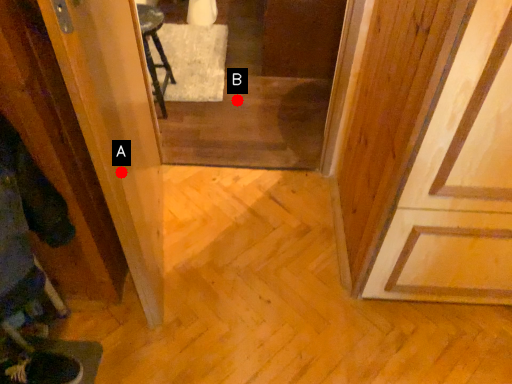
Question: Two points are circled on the image, labeled by A and B beside each circle. Which point is closer to the camera taking this photo?

Choices:
 (A) A is closer
 (B) B is closer

Answer: (A)